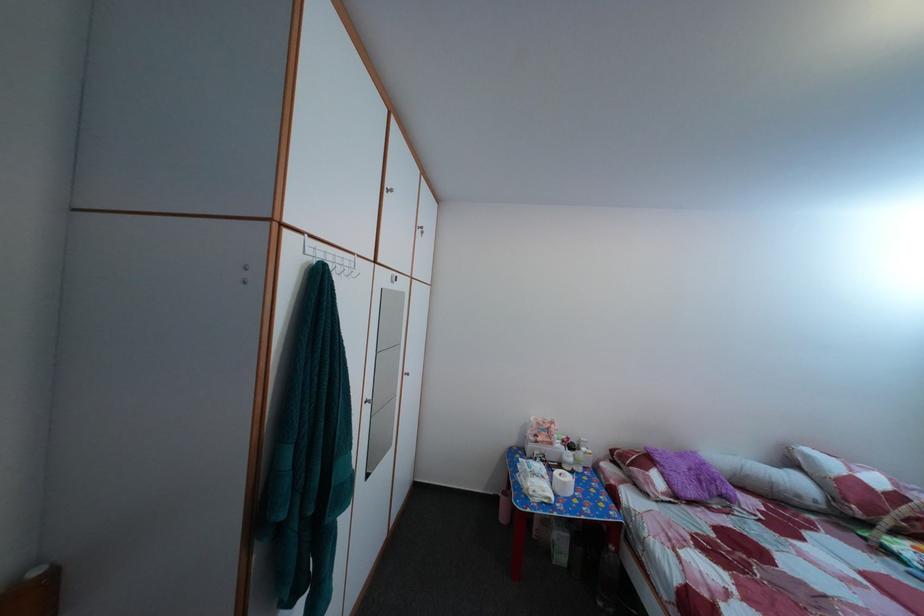
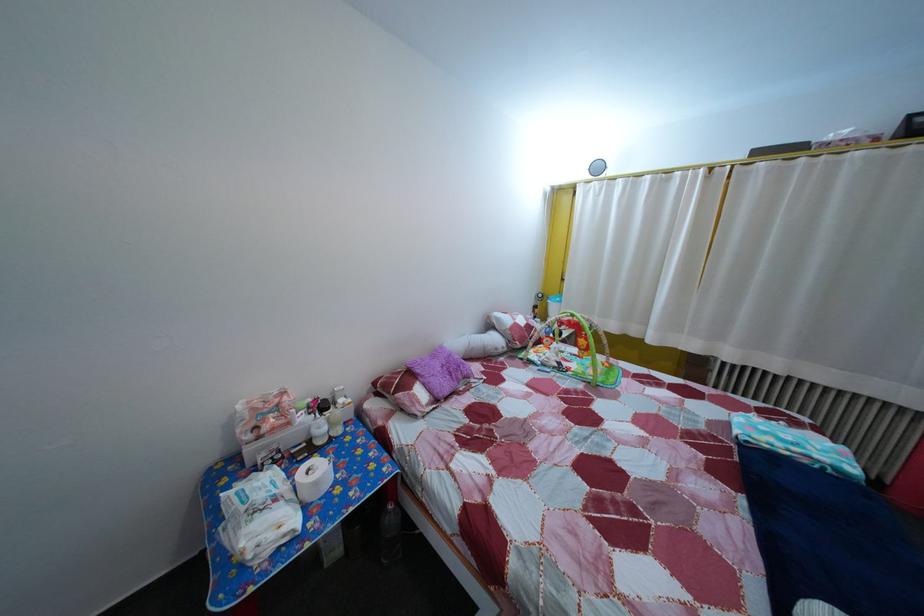
Where in the second image is the point corresponding to [672,482] from the first image?

(433, 392)